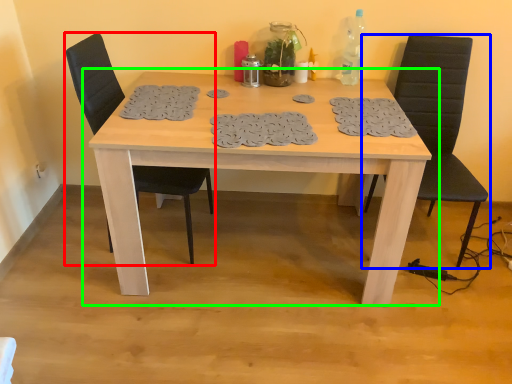
Question: Which is nearer to the chair (highlighted by a red box)? chair (highlighted by a blue box) or table (highlighted by a green box).

Choices:
 (A) chair
 (B) table

Answer: (B)